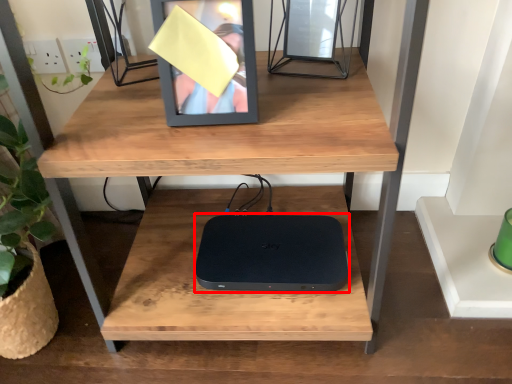
Question: Observing the image, what is the correct spatial positioning of computer (annotated by the red box) in reference to picture frame?

Choices:
 (A) right
 (B) left

Answer: (A)